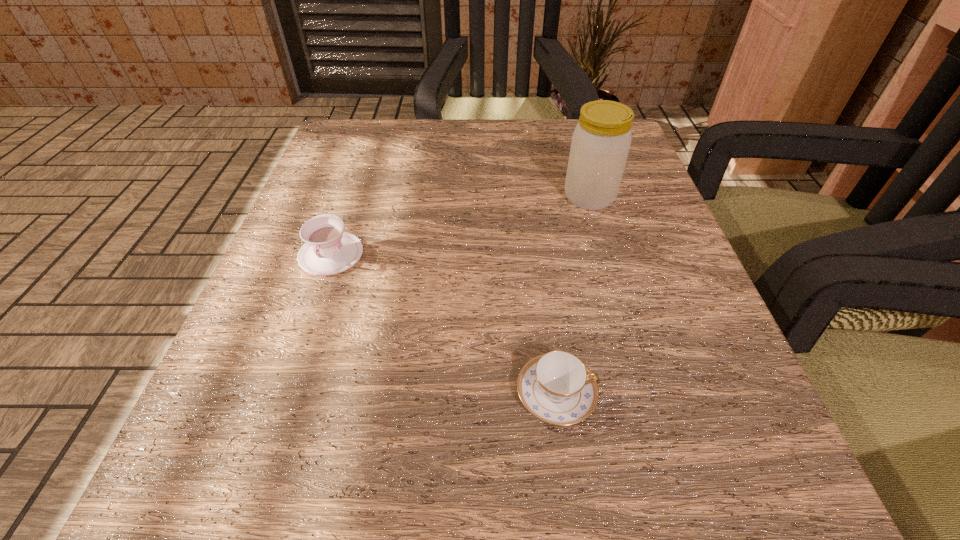
Find the location of a particular element. object at the right edge is located at coordinates (600, 144).

This screenshot has height=540, width=960. I want to click on vacant space at the far edge of the desktop, so click(425, 160).

In the image, there is a desktop. What are the coordinates of `vacant space at the near edge` in the screenshot? It's located at (517, 490).

The height and width of the screenshot is (540, 960). Identify the location of vacant space at the left edge. (277, 258).

This screenshot has height=540, width=960. I want to click on free space at the right edge of the desktop, so click(658, 206).

Image resolution: width=960 pixels, height=540 pixels. Find the location of `vacant space at the far left corner of the desktop`. vacant space at the far left corner of the desktop is located at coordinates (322, 161).

Find the location of `vacant region at the near right corner of the desktop`. vacant region at the near right corner of the desktop is located at coordinates (689, 453).

I want to click on empty space that is in between the jar and the farther teacup, so click(460, 226).

I want to click on vacant space that is in between the rightmost object and the second farthest object, so click(x=460, y=226).

I want to click on free point between the right teacup and the left teacup, so click(x=444, y=324).